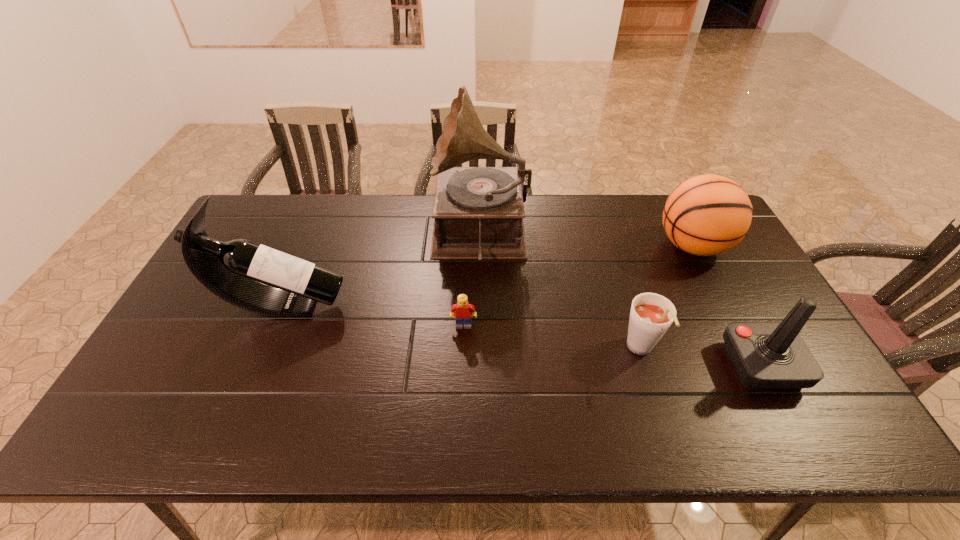
In order to click on basketball present at the right edge in this screenshot , I will do `click(705, 215)`.

At what (x,y) coordinates should I click in order to perform the action: click on joystick present at the right edge. Please return your answer as a coordinate pair (x, y). This screenshot has width=960, height=540. Looking at the image, I should click on (766, 355).

Locate an element on the screen. object that is at the far right corner is located at coordinates (705, 215).

Find the location of a particular element. The height and width of the screenshot is (540, 960). vacant space at the far edge of the desktop is located at coordinates (536, 199).

The image size is (960, 540). In the image, there is a desktop. Identify the location of vacant space at the near edge. (382, 440).

Locate an element on the screen. The height and width of the screenshot is (540, 960). blank space at the left edge of the desktop is located at coordinates (200, 364).

This screenshot has height=540, width=960. In the image, there is a desktop. Find the location of `free space at the near left corner`. free space at the near left corner is located at coordinates (137, 417).

I want to click on free space between the record player and the root beer, so click(561, 293).

Where is `empty space that is in between the joystick and the record player`? This screenshot has height=540, width=960. empty space that is in between the joystick and the record player is located at coordinates click(621, 300).

Locate an element on the screen. free space between the third farthest object and the basketball is located at coordinates (488, 276).